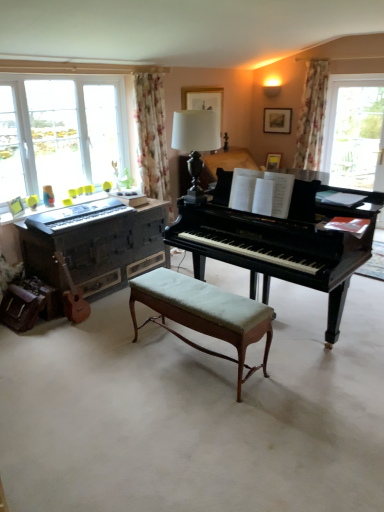
Question: Is white glossy table lamp at center shorter than wooden acoustic guitar at lower left?

Choices:
 (A) yes
 (B) no

Answer: (B)

Question: From the image's perspective, is white glossy table lamp at center over wooden acoustic guitar at lower left?

Choices:
 (A) yes
 (B) no

Answer: (A)

Question: Is white glossy table lamp at center positioned in front of wooden acoustic guitar at lower left?

Choices:
 (A) yes
 (B) no

Answer: (A)

Question: Is white glossy table lamp at center not within wooden acoustic guitar at lower left?

Choices:
 (A) no
 (B) yes

Answer: (B)

Question: From a real-world perspective, is white glossy table lamp at center beneath wooden acoustic guitar at lower left?

Choices:
 (A) no
 (B) yes

Answer: (A)

Question: Can you confirm if white glossy table lamp at center is smaller than wooden acoustic guitar at lower left?

Choices:
 (A) yes
 (B) no

Answer: (B)

Question: Considering the relative positions of light green upholstered bench at center and matte black keyboard at left in the image provided, is light green upholstered bench at center behind matte black keyboard at left?

Choices:
 (A) yes
 (B) no

Answer: (B)

Question: Considering the relative sizes of light green upholstered bench at center and matte black keyboard at left in the image provided, is light green upholstered bench at center thinner than matte black keyboard at left?

Choices:
 (A) yes
 (B) no

Answer: (A)

Question: Is light green upholstered bench at center in front of matte black keyboard at left?

Choices:
 (A) yes
 (B) no

Answer: (A)

Question: Can you confirm if light green upholstered bench at center is shorter than matte black keyboard at left?

Choices:
 (A) no
 (B) yes

Answer: (A)

Question: Considering the relative positions of light green upholstered bench at center and matte black keyboard at left in the image provided, is light green upholstered bench at center to the left of matte black keyboard at left from the viewer's perspective?

Choices:
 (A) yes
 (B) no

Answer: (B)

Question: Is light green upholstered bench at center outside matte black keyboard at left?

Choices:
 (A) yes
 (B) no

Answer: (A)

Question: Considering the relative sizes of matte black keyboard at left and wooden piano at left, the second piano positioned from the right, in the image provided, is matte black keyboard at left thinner than wooden piano at left, the second piano positioned from the right,?

Choices:
 (A) yes
 (B) no

Answer: (A)